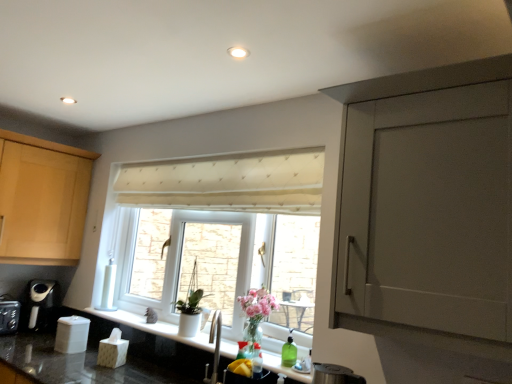
The width and height of the screenshot is (512, 384). Describe the element at coordinates (221, 236) in the screenshot. I see `white textured window at center` at that location.

Measure the distance between clear glass vase at lower center and camera.

A distance of 1.90 meters exists between clear glass vase at lower center and camera.

The height and width of the screenshot is (384, 512). What are the coordinates of `black granite countertop at lower center` in the screenshot? It's located at (145, 343).

Identify the location of matte wood cabinet at left. The image size is (512, 384). (42, 200).

This screenshot has width=512, height=384. I want to click on white textured window at center, so click(221, 236).

Does matte gray cabinet door at right have a lesser height compared to white textured window at center?

Incorrect, the height of matte gray cabinet door at right does not fall short of that of white textured window at center.

Is matte gray cabinet door at right oriented away from white textured window at center?

No.

The image size is (512, 384). What are the coordinates of `window on the left of the matte gray cabinet door at right` in the screenshot? It's located at (221, 236).

I want to click on sink below the matte gray cabinet door at right (from a real-world perspective), so click(252, 330).

Which is behind, point (429, 133) or point (251, 320)?

The point (251, 320) is behind.

Between matte gray cabinet door at right and clear glass vase at lower center, which one is positioned behind?

clear glass vase at lower center is behind.

From the picture: Is matte gray cabinet door at right next to clear glass vase at lower center?

No, matte gray cabinet door at right is not touching clear glass vase at lower center.

Locate an element on the screen. The image size is (512, 384). coffee machine below the white matte pot at window (from the image's perspective) is located at coordinates (40, 303).

Is white matte pot at window shorter than black plastic coffee machine at lower left?

No, white matte pot at window is not shorter than black plastic coffee machine at lower left.

From the image's perspective, is white matte pot at window located beneath black plastic coffee machine at lower left?

No, from the image's perspective, white matte pot at window is not below black plastic coffee machine at lower left.

Is white matte pot at window located outside black plastic coffee machine at lower left?

Yes, white matte pot at window is located beyond the bounds of black plastic coffee machine at lower left.

Which of these two, matte wood cabinet at left or white matte pot at window, is smaller?

With smaller size is white matte pot at window.

From a real-world perspective, does matte wood cabinet at left stand above white matte pot at window?

Indeed, from a real-world perspective, matte wood cabinet at left stands above white matte pot at window.

Could you tell me if matte wood cabinet at left is turned towards white matte pot at window?

Yes, matte wood cabinet at left is aimed at white matte pot at window.

Based on their positions, is black granite countertop at lower center located to the left or right of black plastic coffee machine at lower left?

Based on their positions, black granite countertop at lower center is located to the right of black plastic coffee machine at lower left.

Between point (185, 347) and point (27, 293), which one is positioned behind?

The point (27, 293) is behind.

Between black granite countertop at lower center and black plastic coffee machine at lower left, which one has smaller size?

black granite countertop at lower center.

Is black granite countertop at lower center looking in the opposite direction of black plastic coffee machine at lower left?

No, black granite countertop at lower center is not facing away from black plastic coffee machine at lower left.

From a real-world perspective, does black plastic coffee machine at lower left stand above clear glass vase at lower center?

Incorrect, from a real-world perspective, black plastic coffee machine at lower left is lower than clear glass vase at lower center.

Between black plastic coffee machine at lower left and clear glass vase at lower center, which one has more height?

With more height is clear glass vase at lower center.

Is black plastic toaster at lower left oriented away from black plastic coffee machine at lower left?

That's not correct — black plastic toaster at lower left is not looking away from black plastic coffee machine at lower left.

From a real-world perspective, between black plastic toaster at lower left and black plastic coffee machine at lower left, who is vertically lower?

black plastic toaster at lower left, from a real-world perspective.

In the scene shown: Does black plastic toaster at lower left appear on the left side of black plastic coffee machine at lower left?

Indeed, black plastic toaster at lower left is positioned on the left side of black plastic coffee machine at lower left.

Locate an element on the screen. The height and width of the screenshot is (384, 512). window that is under the matte gray cabinet door at right (from a real-world perspective) is located at coordinates (221, 236).

This screenshot has height=384, width=512. In order to click on door on the right of clear glass vase at lower center in this screenshot , I will do `click(429, 211)`.

Estimate the real-world distances between objects in this image. Which object is closer to white matte pot at window, matte gray cabinet door at right or black plastic coffee machine at lower left?

Based on the image, black plastic coffee machine at lower left appears to be nearer to white matte pot at window.

When comparing their distances from white matte pot at window, does matte wood cabinet at left or cream quilted curtain at center seem closer?

The object closer to white matte pot at window is cream quilted curtain at center.

Which object lies further to the anchor point black plastic toaster at lower left, matte gray cabinet door at right or black plastic coffee machine at lower left?

matte gray cabinet door at right is further to black plastic toaster at lower left.

When comparing their distances from black plastic toaster at lower left, does matte wood cabinet at left or white matte pot at window seem further?

white matte pot at window is positioned further to the anchor black plastic toaster at lower left.

From the picture: When comparing their distances from white textured window at center, does black granite countertop at lower center or cream quilted curtain at center seem closer?

cream quilted curtain at center lies closer to white textured window at center than the other object.

Looking at the image, which one is located closer to matte gray cabinet door at right, black plastic coffee machine at lower left or black granite countertop at lower center?

black granite countertop at lower center is closer to matte gray cabinet door at right.

Which object lies further to the anchor point cream quilted curtain at center, clear glass vase at lower center or black plastic toaster at lower left?

Among the two, black plastic toaster at lower left is located further to cream quilted curtain at center.

When comparing their distances from white matte pot at window, does clear glass vase at lower center or matte gray cabinet door at right seem closer?

clear glass vase at lower center is closer to white matte pot at window.

This screenshot has height=384, width=512. Identify the location of sink between matte wood cabinet at left and matte gray cabinet door at right. (252, 330).

Identify the location of countertop situated between matte wood cabinet at left and clear glass vase at lower center from left to right. (145, 343).

Find the location of a particular element. The width and height of the screenshot is (512, 384). cabinetry situated between black plastic toaster at lower left and cream quilted curtain at center from left to right is located at coordinates (42, 200).

At what (x,y) coordinates should I click in order to perform the action: click on plant between matte wood cabinet at left and clear glass vase at lower center from left to right. Please return your answer as a coordinate pair (x, y). The width and height of the screenshot is (512, 384). Looking at the image, I should click on (192, 295).